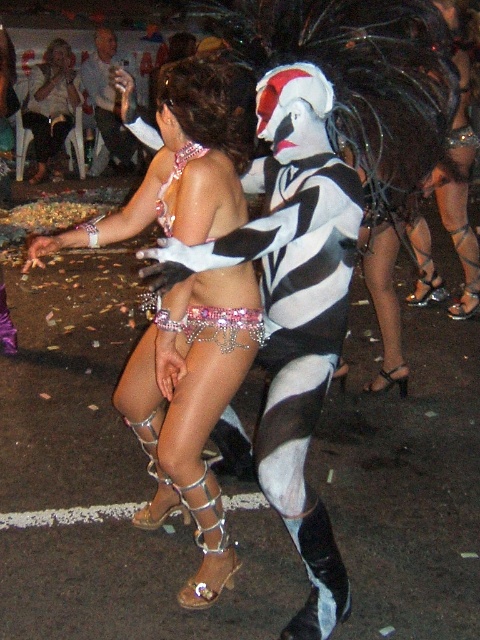
You are a costume designer assessing the two metallic accessories in the image. You need to determine which one is larger. The accessories are the shiny silver bikini at center and the metallic silver chainmail at lower center. Which one is bigger?

The shiny silver bikini at center is bigger than the metallic silver chainmail at lower center.

You are a photographer trying to capture a photo of the pink sequined bikini top at center and the matte white blouse at upper left. Which object should you focus on first if you want to include both in your frame without moving the camera?

The matte white blouse at upper left is to the left of the pink sequined bikini top at center, so you should focus on the matte white blouse at upper left first to ensure both are in frame without moving the camera.

From the picture: You are standing at the center of the street where the performance is happening. There is a point marked at coordinates point [68,76] that is 8.49 meters away from you. If you want to reach that point quickly, should you walk towards the left or the right side of the street?

The point [68,76] is 8.49 meters away from the viewer. To reach it quickly, you should walk directly towards it, but since the question specifies left or right, more information about the street layout is needed. However, based on the coordinates, if the point is to the left relative to your position, go left, else right. But given the description, the exact direction isnegative.